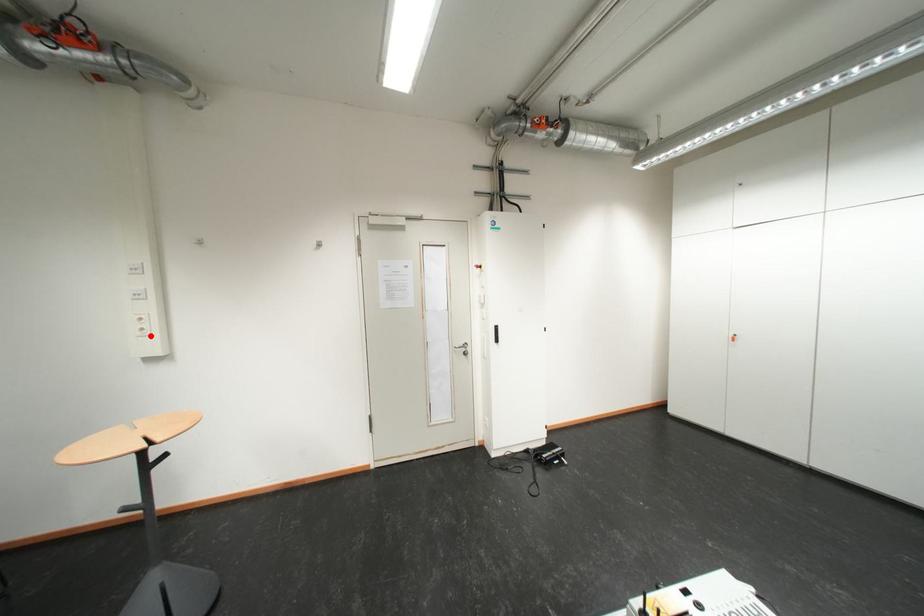
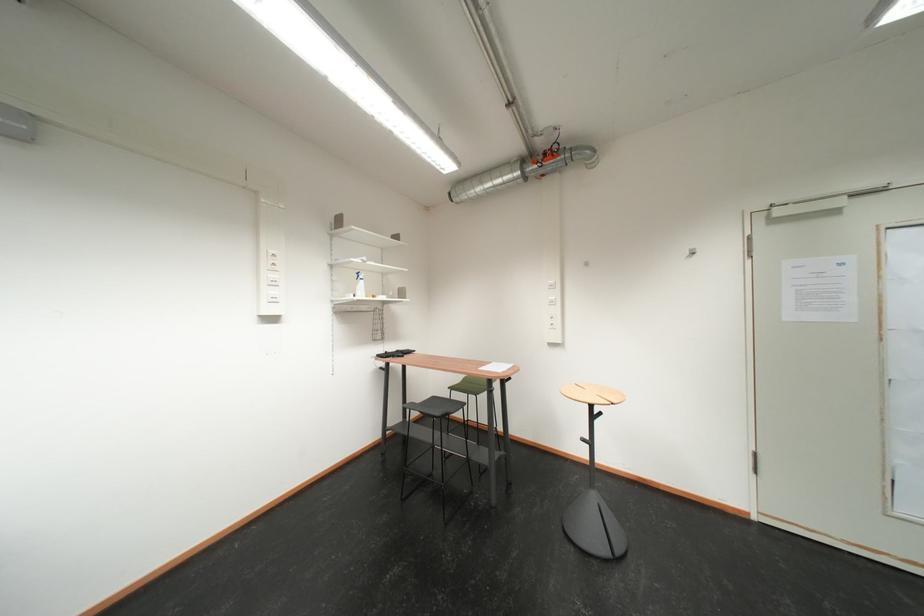
In the second image, find the point that corresponds to the highlighted location in the first image.

(562, 329)